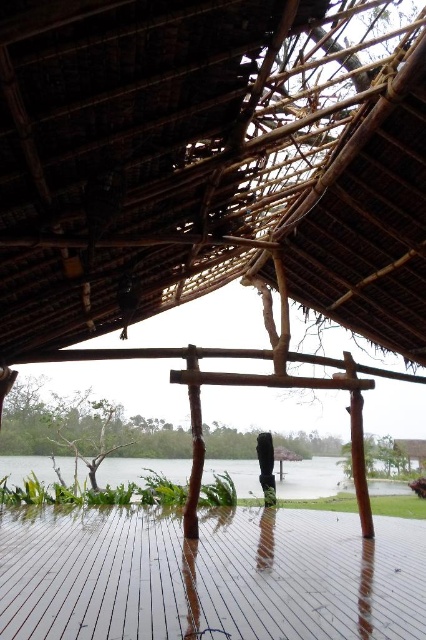
You are standing inside the traditional structure and want to place a tall plant pot on the floor. Considering the height of the brown thatch roof at center and the brown wooden deck at center, will the plant pot hit the roof if it is 1.2 meters tall?

The brown thatch roof at center is taller than the brown wooden deck at center. Since the deck is part of the floor, the actual height from the floor to the roof would depend on the structure. However, the description does not provide specific measurements. Therefore, it is uncertain if the 1.2 meter tall plant pot will hit the roof.

From the picture: You are standing inside the traditional structure and want to look at the clear water at center. Which direction should you look relative to the brown thatch roof at center?

The clear water at center is located below the brown thatch roof at center, so you should look downward from the brown thatch roof at center to see the clear water at center.

You are standing inside the traditional structure and want to place a large wooden bench. The bench is 2 meters long. There are two areas available for placement based on the objects present. Which area, the brown wooden deck at center or the clear water at center, is suitable for placing the bench?

The brown wooden deck at center is suitable for placing the bench since it is larger in size than the clear water at center, providing enough space for the 2 meter long bench.